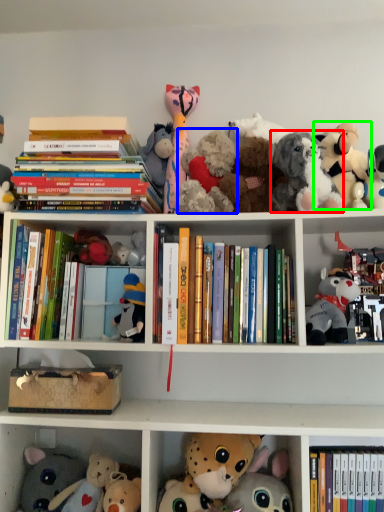
Question: Which object is positioned farthest from toy (highlighted by a red box)? Select from toy (highlighted by a blue box) and toy (highlighted by a green box).

Choices:
 (A) toy
 (B) toy

Answer: (A)